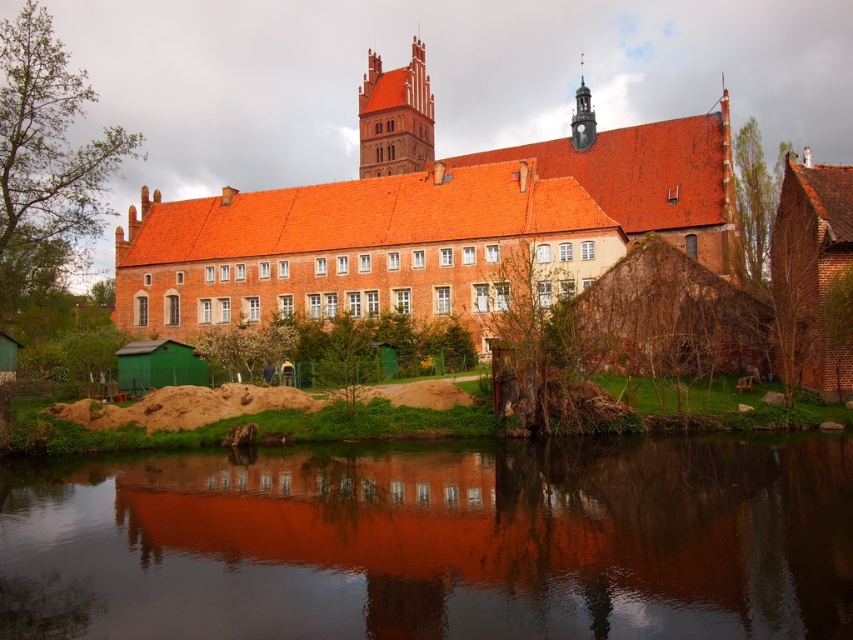
You are an architect analyzing the symmetry of the building and its reflection. Given the smooth water at center and the matte brick tower at upper center, which object would you say occupies a larger area in the scene?

The matte brick tower at upper center occupies a larger area in the scene compared to the smooth water at center, as the smooth water at center has a smaller size compared to matte brick tower at upper center.

You are standing at the edge of the smooth water at center and want to throw a stone to see how far it will travel. If the stone can travel 80 feet in a straight line, will it reach the other side of the water?

The smooth water at center and viewer are 79.92 feet apart from each other. Since the stone can travel 80 feet, it will just barely reach the other side of the smooth water at center.